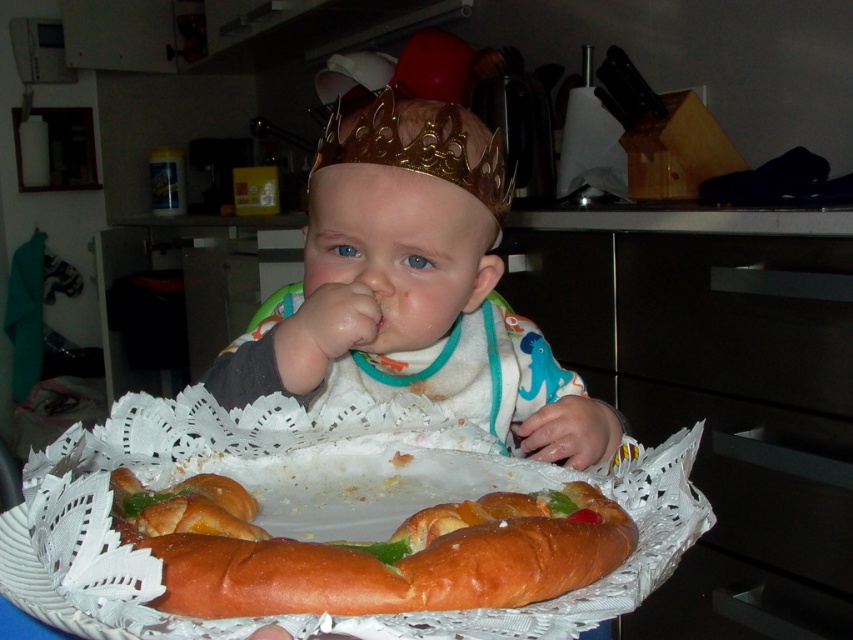
Question: Which point is closer to the camera?

Choices:
 (A) (495, 218)
 (B) (381, 324)
 (C) (514, 330)
 (D) (601, 525)

Answer: (D)

Question: Does gold metallic crown at center appear over pink smooth flesh at center?

Choices:
 (A) yes
 (B) no

Answer: (A)

Question: Which object is farther from the camera taking this photo?

Choices:
 (A) pink smooth flesh at center
 (B) gold metallic crown at center

Answer: (B)

Question: Which point is closer to the camera?

Choices:
 (A) gold metallic crown at center
 (B) gold shiny crown at center
 (C) gold crown at center
 (D) pink smooth flesh at center

Answer: (B)

Question: Is the position of gold shiny crown at center more distant than that of pink smooth flesh at center?

Choices:
 (A) yes
 (B) no

Answer: (B)

Question: Is the position of golden bread ring at center less distant than that of gold metallic crown at center?

Choices:
 (A) no
 (B) yes

Answer: (B)